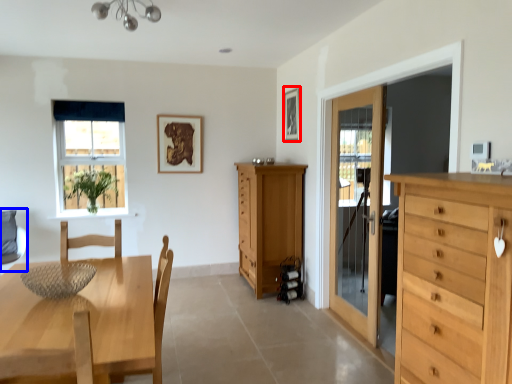
Question: Which of the following is the closest to the observer, picture frame (highlighted by a red box) or swivel chair (highlighted by a blue box)?

Choices:
 (A) picture frame
 (B) swivel chair

Answer: (B)